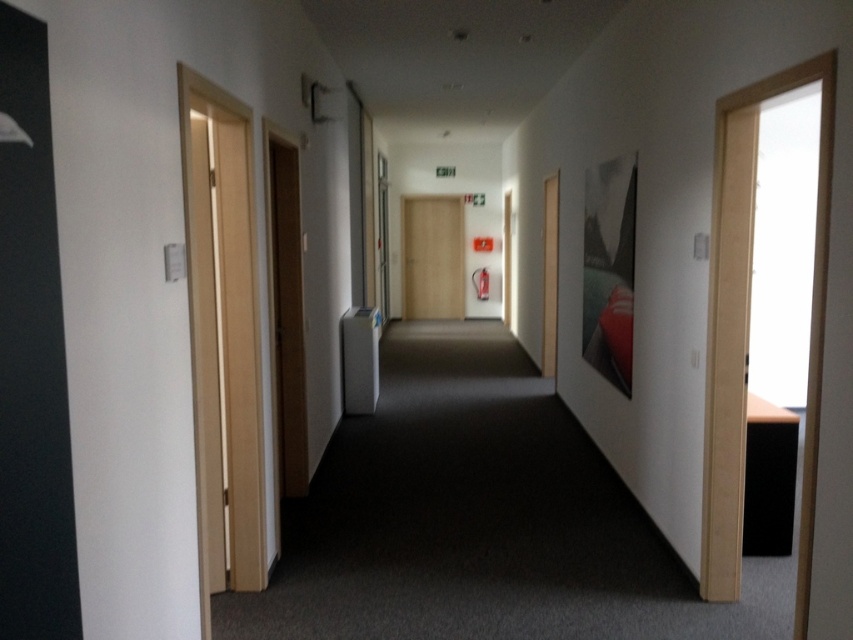
Question: Which object is closer to the camera taking this photo?

Choices:
 (A) wooden door at center
 (B) light wood door at left

Answer: (B)

Question: Can you confirm if light wood door at left is positioned to the left of wooden door at center?

Choices:
 (A) no
 (B) yes

Answer: (B)

Question: Can you confirm if light wood door at left is positioned to the left of wooden door at center?

Choices:
 (A) no
 (B) yes

Answer: (B)

Question: Does light wood door at left come in front of wooden door at center?

Choices:
 (A) no
 (B) yes

Answer: (B)